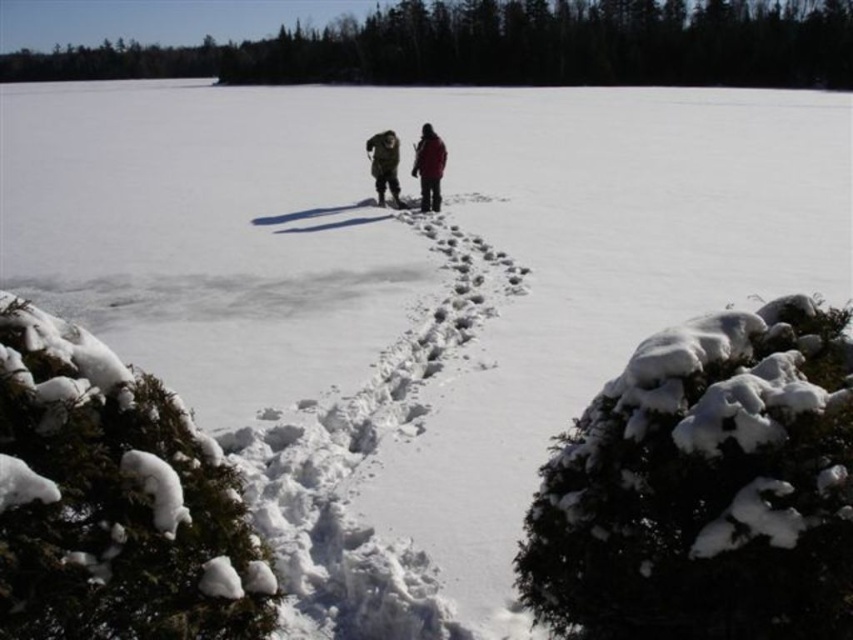
Question: Is white fluffy snow trail at center to the left of dark brown fur coat at center from the viewer's perspective?

Choices:
 (A) no
 (B) yes

Answer: (A)

Question: Does white fluffy snow trail at center have a lesser width compared to dark green jacket at center?

Choices:
 (A) yes
 (B) no

Answer: (B)

Question: Is red wool jacket at center further to the viewer compared to dark green jacket at center?

Choices:
 (A) no
 (B) yes

Answer: (A)

Question: Which object appears farthest from the camera in this image?

Choices:
 (A) snow-covered pine at lower left
 (B) white fluffy snow trail at center
 (C) dark green jacket at center
 (D) dark brown fur coat at center

Answer: (C)

Question: Which object is the farthest from the red wool jacket at center?

Choices:
 (A) dark green jacket at center
 (B) dark brown fur coat at center

Answer: (A)

Question: Based on their relative distances, which object is farther from the red wool jacket at center?

Choices:
 (A) dark brown fur coat at center
 (B) snow-covered pine at lower left
 (C) dark green jacket at center

Answer: (B)